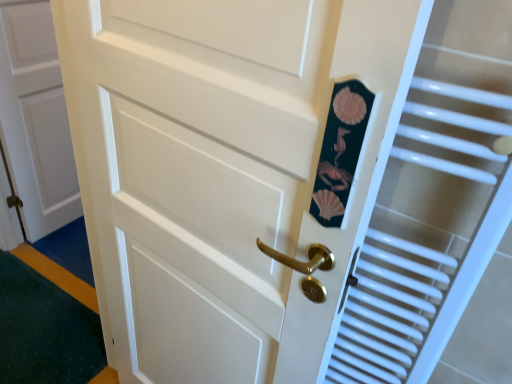
Locate an element on the screen. Image resolution: width=512 pixels, height=384 pixels. white plastic radiator at right is located at coordinates (431, 213).

Describe the element at coordinates (431, 213) in the screenshot. I see `white plastic radiator at right` at that location.

Image resolution: width=512 pixels, height=384 pixels. What do you see at coordinates (36, 119) in the screenshot?
I see `white matte door at left` at bounding box center [36, 119].

Where is `white matte door at left`? Image resolution: width=512 pixels, height=384 pixels. white matte door at left is located at coordinates (36, 119).

Where is `white plastic radiator at right`? This screenshot has width=512, height=384. white plastic radiator at right is located at coordinates (431, 213).

Is white matte door at left at the right side of white plastic radiator at right?

Incorrect, white matte door at left is not on the right side of white plastic radiator at right.

Does white matte door at left come in front of white plastic radiator at right?

No, it is behind white plastic radiator at right.

Which is behind, point (7, 68) or point (504, 184)?

The point (7, 68) is more distant.

From the image's perspective, is white matte door at left above or below white plastic radiator at right?

white matte door at left is above white plastic radiator at right.

From a real-world perspective, is white matte door at left positioned above or below white plastic radiator at right?

From a real-world perspective, white matte door at left is physically below white plastic radiator at right.

In the scene shown: Which of these two, white matte door at left or white plastic radiator at right, is thinner?

white matte door at left is thinner.

Which of these two, white matte door at left or white plastic radiator at right, stands taller?

white matte door at left is taller.

Which of these two, white matte door at left or white plastic radiator at right, is bigger?

white matte door at left.

Choose the correct answer: Is white matte door at left inside white plastic radiator at right or outside it?

The correct answer is: outside.

Are white matte door at left and white plastic radiator at right beside each other?

There is a gap between white matte door at left and white plastic radiator at right.

Is white matte door at left looking in the opposite direction of white plastic radiator at right?

white matte door at left does not have its back to white plastic radiator at right.

Image resolution: width=512 pixels, height=384 pixels. I want to click on door lying above the white plastic radiator at right (from the image's perspective), so click(x=36, y=119).

Between white plastic radiator at right and white matte door at left, which one appears on the right side from the viewer's perspective?

white plastic radiator at right is more to the right.

Based on the photo, considering the positions of objects white plastic radiator at right and white matte door at left in the image provided, who is behind, white plastic radiator at right or white matte door at left?

white matte door at left is further from the camera.

Between point (438, 152) and point (20, 47), which one is positioned behind?

The point (20, 47) is behind.

From the image's perspective, which one is positioned higher, white plastic radiator at right or white matte door at left?

white matte door at left, from the image's perspective.

From a real-world perspective, is white plastic radiator at right beneath white matte door at left?

Incorrect, from a real-world perspective, white plastic radiator at right is higher than white matte door at left.

Based on the photo, does white plastic radiator at right have a greater width compared to white matte door at left?

Yes, white plastic radiator at right is wider than white matte door at left.

Is white plastic radiator at right taller than white matte door at left?

No, white plastic radiator at right is not taller than white matte door at left.

Considering the sizes of objects white plastic radiator at right and white matte door at left in the image provided, who is smaller, white plastic radiator at right or white matte door at left?

Smaller between the two is white plastic radiator at right.

Is white plastic radiator at right outside of white matte door at left?

That's correct, white plastic radiator at right is outside of white matte door at left.

Are white plastic radiator at right and white matte door at left beside each other?

white plastic radiator at right and white matte door at left are clearly separated.

From the picture: Is white plastic radiator at right oriented away from white matte door at left?

No, white plastic radiator at right is not facing away from white matte door at left.

Locate an element on the screen. This screenshot has height=384, width=512. elevator above the white matte door at left (from a real-world perspective) is located at coordinates (431, 213).

Where is `door located underneath the white plastic radiator at right (from a real-world perspective)`? This screenshot has width=512, height=384. door located underneath the white plastic radiator at right (from a real-world perspective) is located at coordinates (36, 119).

Identify the location of elevator located in front of the white matte door at left. The height and width of the screenshot is (384, 512). (431, 213).